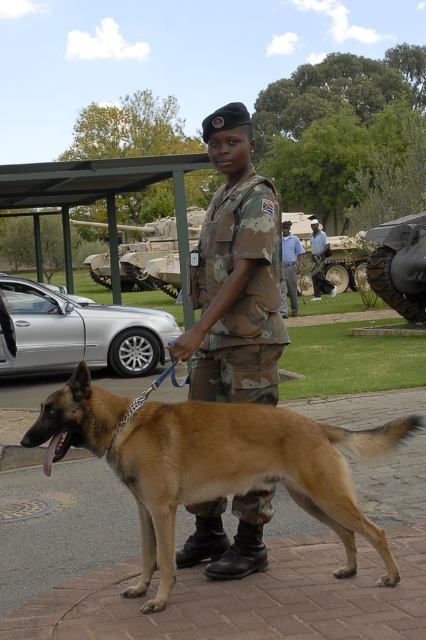
Question: Which point is closer to the camera?

Choices:
 (A) (43, 362)
 (B) (192, 218)

Answer: (A)

Question: Which point is closer to the camera taking this photo?

Choices:
 (A) (270, 387)
 (B) (198, 221)
 (C) (288, 228)

Answer: (A)

Question: Is brown fur dog at center thinner than camouflage paint tank at center?

Choices:
 (A) no
 (B) yes

Answer: (B)

Question: Can you confirm if brown fur dog at center is positioned to the left of camouflage fabric uniform at center?

Choices:
 (A) no
 (B) yes

Answer: (B)

Question: Can you confirm if silver metallic car at left is positioned to the left of camouflage paint tank at center?

Choices:
 (A) yes
 (B) no

Answer: (B)

Question: Among these points, which one is farthest from the camera?

Choices:
 (A) (233, 362)
 (B) (244, 448)
 (C) (293, 316)

Answer: (C)